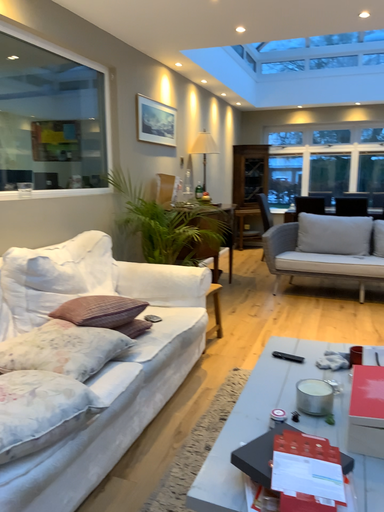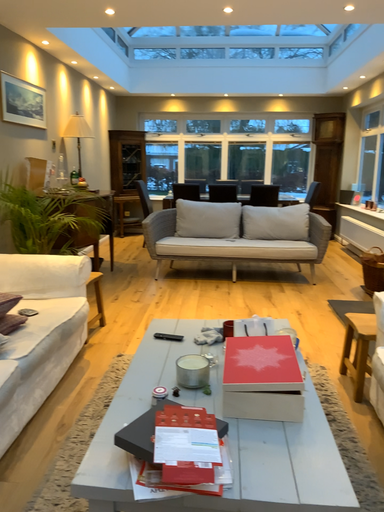
Question: Which way did the camera rotate in the video?

Choices:
 (A) rotated left
 (B) rotated right

Answer: (B)